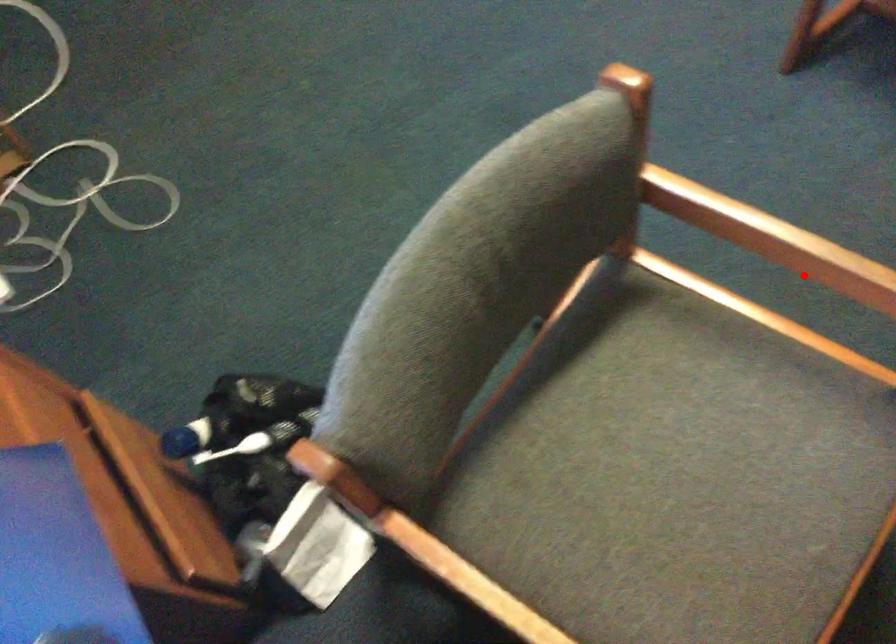
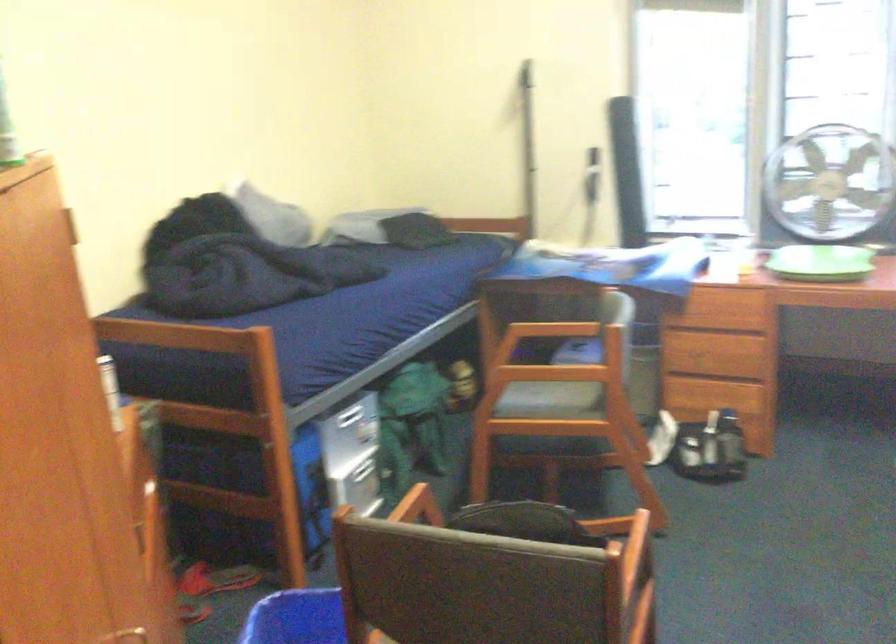
Question: I am providing you with two images of the same scene from different viewpoints. Image1 has a red point marked. In image2, the corresponding 3D location appears at what relative position? Reply with the corresponding letter.

Choices:
 (A) Closer
 (B) Farther

Answer: (B)